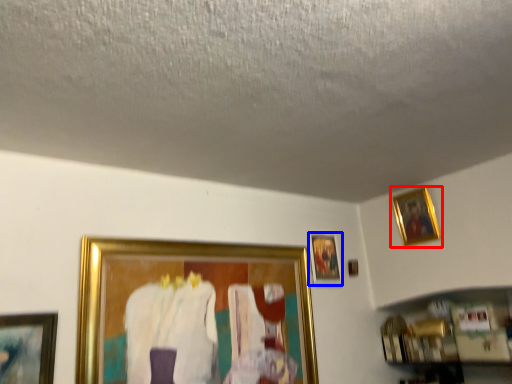
Question: Which object is closer to the camera taking this photo, picture frame (highlighted by a red box) or picture frame (highlighted by a blue box)?

Choices:
 (A) picture frame
 (B) picture frame

Answer: (A)